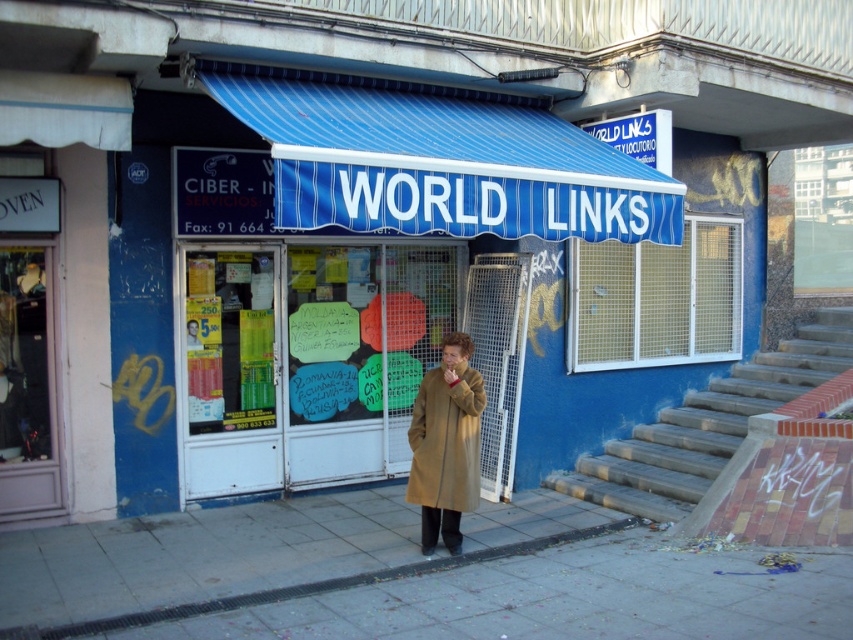
Question: Can you confirm if smooth concrete pavement at center is wider than beige wool coat at center?

Choices:
 (A) no
 (B) yes

Answer: (B)

Question: Can you confirm if smooth concrete pavement at center is bigger than beige wool coat at center?

Choices:
 (A) yes
 (B) no

Answer: (A)

Question: Which point is closer to the camera?

Choices:
 (A) beige wool coat at center
 (B) smooth concrete pavement at center

Answer: (B)

Question: Which point appears farthest from the camera in this image?

Choices:
 (A) click(x=473, y=438)
 (B) click(x=415, y=609)

Answer: (A)

Question: Which of the following is the farthest from the observer?

Choices:
 (A) [x=451, y=456]
 (B) [x=405, y=534]

Answer: (B)

Question: Can you confirm if smooth concrete pavement at center is positioned below beige wool coat at center?

Choices:
 (A) no
 (B) yes

Answer: (B)